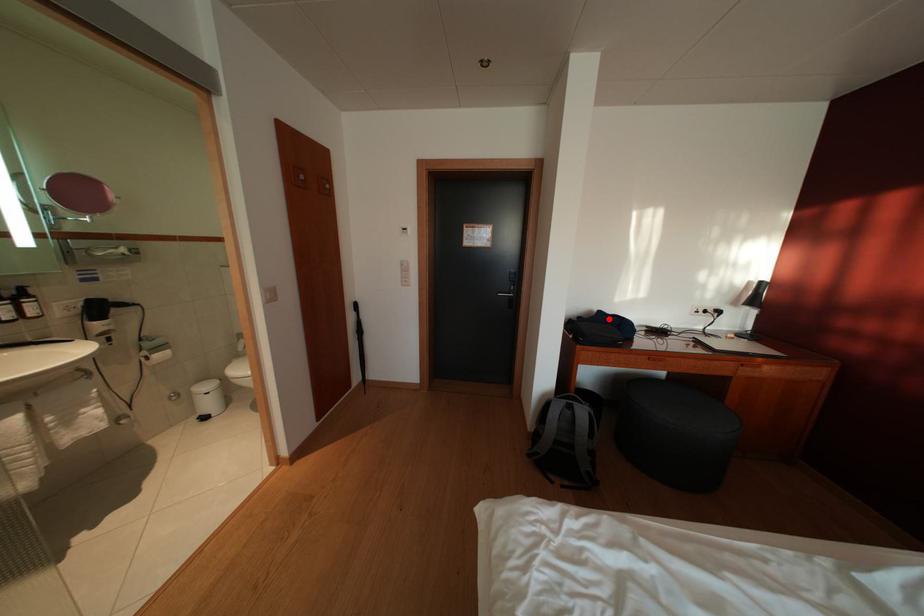
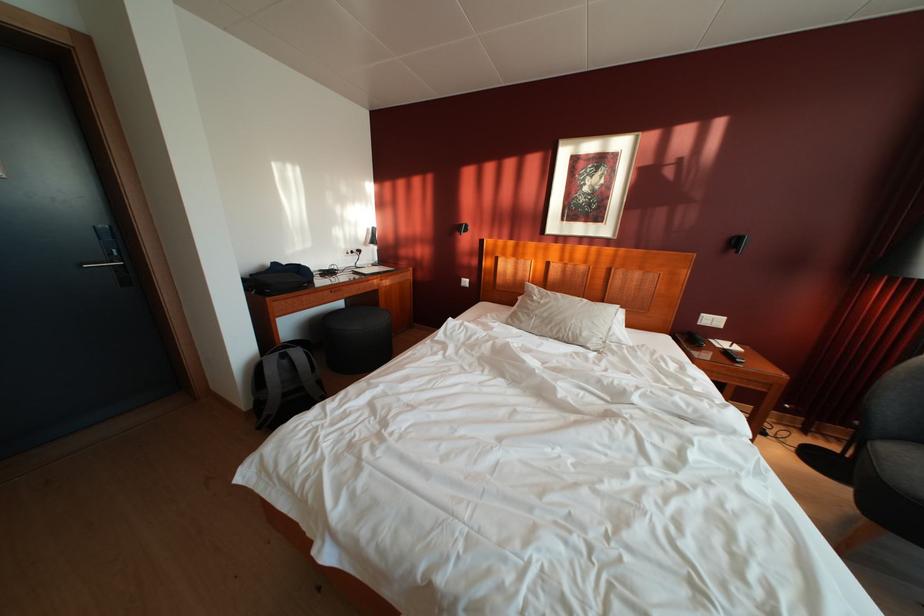
Find the pixel in the second image that matches the highlighted location in the first image.

(284, 270)